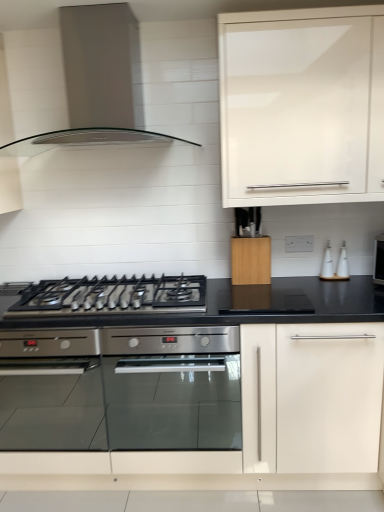
Question: From the image's perspective, is stainless steel oven at center above white glossy soap dispenser at right?

Choices:
 (A) yes
 (B) no

Answer: (B)

Question: Does stainless steel oven at center appear on the left side of white glossy soap dispenser at right?

Choices:
 (A) no
 (B) yes

Answer: (B)

Question: Is stainless steel oven at center touching white glossy soap dispenser at right?

Choices:
 (A) yes
 (B) no

Answer: (B)

Question: From the image's perspective, is stainless steel oven at center below white glossy soap dispenser at right?

Choices:
 (A) no
 (B) yes

Answer: (B)

Question: Is stainless steel oven at center not close to white glossy soap dispenser at right?

Choices:
 (A) yes
 (B) no

Answer: (A)

Question: Does stainless steel oven at center lie behind white glossy soap dispenser at right?

Choices:
 (A) no
 (B) yes

Answer: (A)

Question: From a real-world perspective, does white glossy bottle at right stand above white glossy soap dispenser at right?

Choices:
 (A) yes
 (B) no

Answer: (A)

Question: From the image's perspective, does white glossy bottle at right appear higher than white glossy soap dispenser at right?

Choices:
 (A) yes
 (B) no

Answer: (B)

Question: Is the surface of white glossy bottle at right in direct contact with white glossy soap dispenser at right?

Choices:
 (A) no
 (B) yes

Answer: (B)

Question: Does white glossy bottle at right have a greater width compared to white glossy soap dispenser at right?

Choices:
 (A) yes
 (B) no

Answer: (B)

Question: Can we say white glossy bottle at right lies outside white glossy soap dispenser at right?

Choices:
 (A) no
 (B) yes

Answer: (B)

Question: Would you say white glossy soap dispenser at right is part of white glossy bottle at right's contents?

Choices:
 (A) no
 (B) yes

Answer: (A)

Question: Is the depth of black matte gas stove at center greater than that of white glossy bottle at right?

Choices:
 (A) no
 (B) yes

Answer: (A)